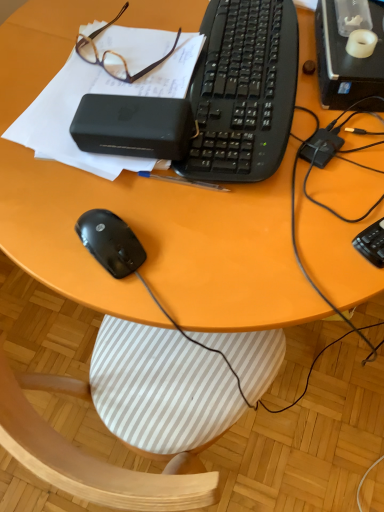
Question: Is brown plastic glasses at upper left at the left side of black plastic desktop computer at upper right?

Choices:
 (A) no
 (B) yes

Answer: (B)

Question: From the image's perspective, is brown plastic glasses at upper left under black plastic desktop computer at upper right?

Choices:
 (A) yes
 (B) no

Answer: (B)

Question: Is brown plastic glasses at upper left oriented away from black plastic desktop computer at upper right?

Choices:
 (A) no
 (B) yes

Answer: (A)

Question: Is brown plastic glasses at upper left at the right side of black plastic desktop computer at upper right?

Choices:
 (A) no
 (B) yes

Answer: (A)

Question: Considering the relative sizes of brown plastic glasses at upper left and black plastic desktop computer at upper right in the image provided, is brown plastic glasses at upper left thinner than black plastic desktop computer at upper right?

Choices:
 (A) no
 (B) yes

Answer: (B)

Question: From a real-world perspective, relative to black plastic desktop computer at upper right, is black plastic keyboard at right, the 1th computer keyboard viewed from the front, vertically above or below?

Choices:
 (A) below
 (B) above

Answer: (A)

Question: In terms of size, does black plastic keyboard at right, the 1th computer keyboard in the right-to-left sequence, appear bigger or smaller than black plastic desktop computer at upper right?

Choices:
 (A) small
 (B) big

Answer: (A)

Question: Considering the positions of point (382, 232) and point (317, 16), is point (382, 232) closer or farther from the camera than point (317, 16)?

Choices:
 (A) farther
 (B) closer

Answer: (B)

Question: From the image's perspective, is black plastic keyboard at right, which is the second computer keyboard from left to right, above or below black plastic desktop computer at upper right?

Choices:
 (A) below
 (B) above

Answer: (A)

Question: Based on their sizes in the image, would you say black matte mouse at lower left is bigger or smaller than black plastic power bank at upper center?

Choices:
 (A) small
 (B) big

Answer: (A)

Question: Does point (89, 210) appear closer or farther from the camera than point (163, 116)?

Choices:
 (A) farther
 (B) closer

Answer: (A)

Question: Considering the positions of black matte mouse at lower left and black plastic power bank at upper center in the image, is black matte mouse at lower left taller or shorter than black plastic power bank at upper center?

Choices:
 (A) short
 (B) tall

Answer: (A)

Question: Looking at their shapes, would you say black matte mouse at lower left is wider or thinner than black plastic power bank at upper center?

Choices:
 (A) thin
 (B) wide

Answer: (B)

Question: Does point (240, 33) appear closer or farther from the camera than point (71, 82)?

Choices:
 (A) closer
 (B) farther

Answer: (B)

Question: In the image, is black plastic keyboard at center, the first computer keyboard viewed from the top, positioned in front of or behind black matte notepad at upper left?

Choices:
 (A) front
 (B) behind

Answer: (A)